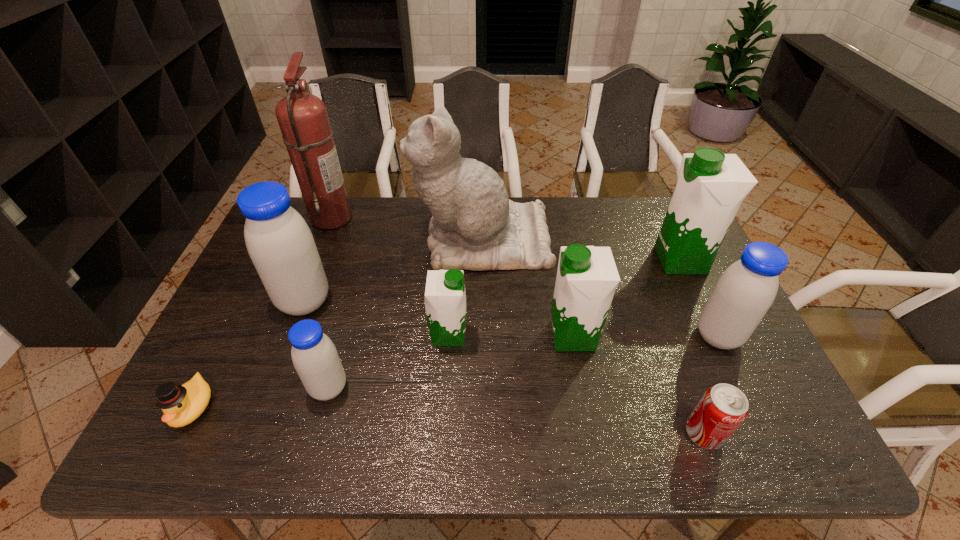
At what (x,y) coordinates should I click in order to perform the action: click on empty space that is in between the duck and the cat. Please return your answer as a coordinate pair (x, y). Looking at the image, I should click on (337, 323).

Find the location of a particular element. The width and height of the screenshot is (960, 540). unoccupied area between the rightmost green soya milk and the rightmost blue soya milk is located at coordinates (699, 298).

The image size is (960, 540). Identify the location of free space that is in between the third soya milk from left to right and the fire extinguisher. (390, 276).

Locate an element on the screen. Image resolution: width=960 pixels, height=540 pixels. free space between the third object from right to left and the farthest soya milk is located at coordinates (692, 347).

Locate an element on the screen. The height and width of the screenshot is (540, 960). free space between the red soda can and the second smallest blue soya milk is located at coordinates (710, 385).

Locate an element on the screen. the eighth closest object to the rightmost green soya milk is located at coordinates (303, 119).

The height and width of the screenshot is (540, 960). Find the location of `the ninth closest object relative to the shortest object`. the ninth closest object relative to the shortest object is located at coordinates (711, 185).

Locate an element on the screen. This screenshot has width=960, height=540. soya milk that is the second closest to the third soya milk from right to left is located at coordinates (745, 291).

Locate an element on the screen. The image size is (960, 540). soya milk that can be found as the fourth closest to the cat is located at coordinates (711, 185).

Locate which green soya milk ranks in proximity to the second green soya milk from right to left. Please provide its 2D coordinates. Your answer should be formatted as a tuple, i.e. [(x, y)], where the tuple contains the x and y coordinates of a point satisfying the conditions above.

[(445, 298)]